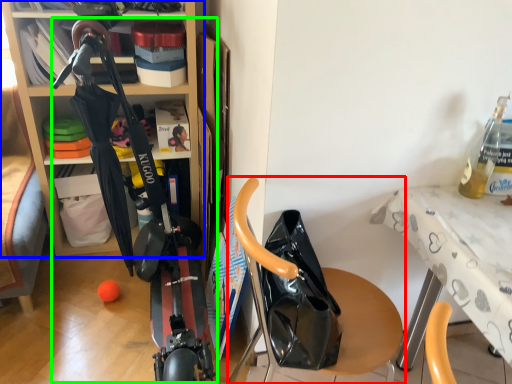
Question: Which object is the farthest from furniture (highlighted by a red box)? Choose among these: shelf (highlighted by a blue box) or sport equipment (highlighted by a green box).

Choices:
 (A) shelf
 (B) sport equipment

Answer: (A)